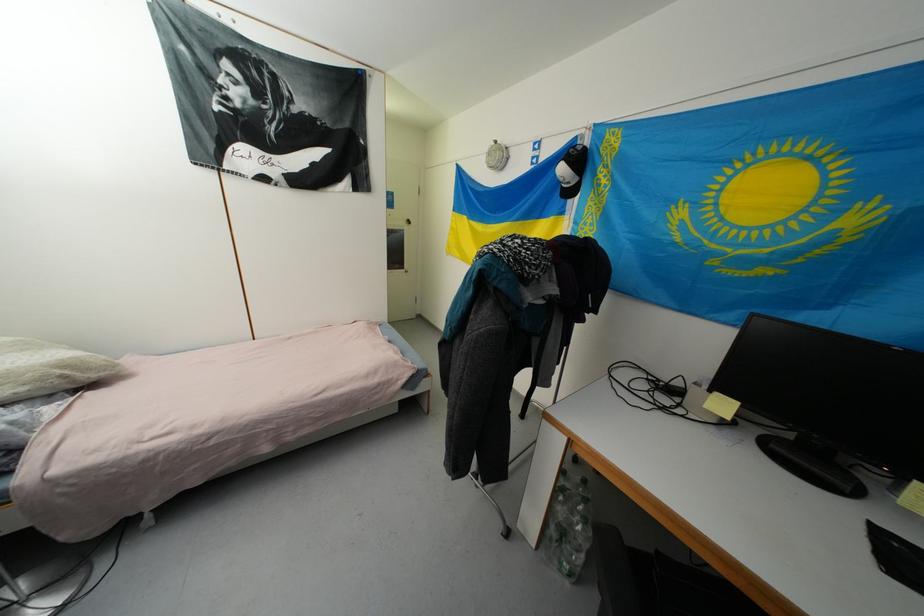
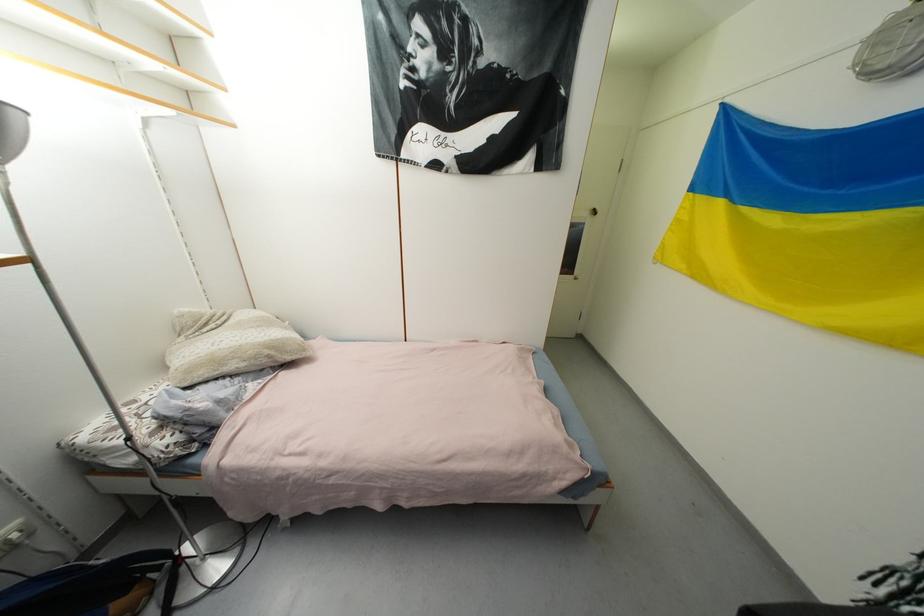
Find the pixel in the second image that matches (46,381) in the first image.

(261, 359)